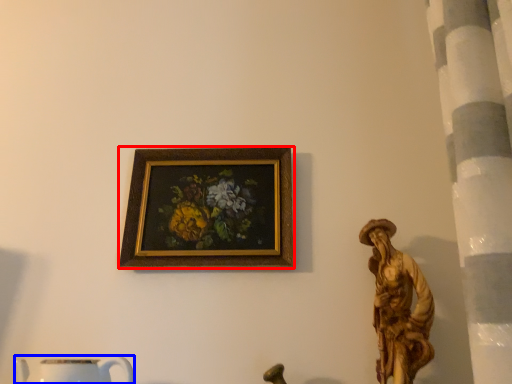
Question: Which of the following is the closest to the observer, picture frame (highlighted by a red box) or mug (highlighted by a blue box)?

Choices:
 (A) picture frame
 (B) mug

Answer: (B)